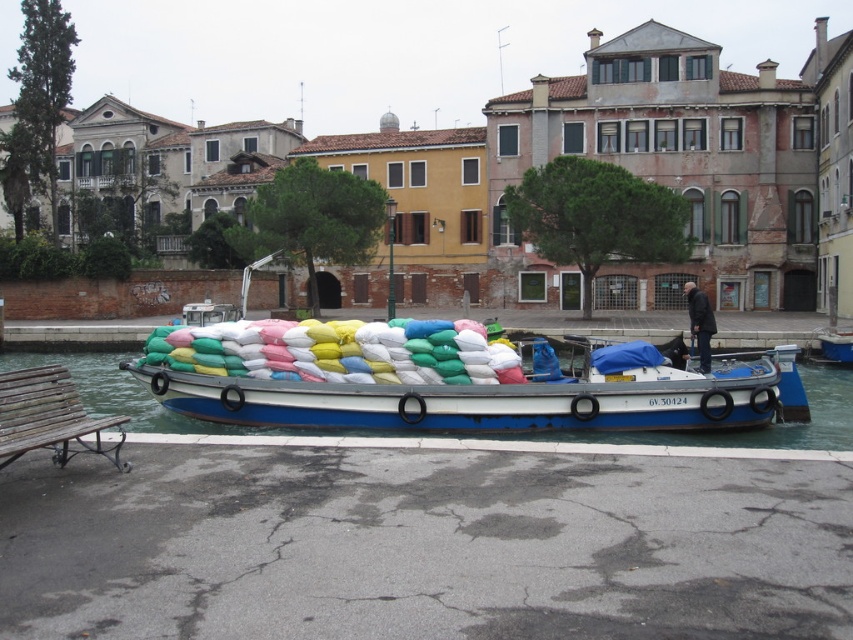
You are a tourist visiting the canal and want to take a photo of the blue painted wood boat at center and the wooden bench at lower left. If you stand at the end of the dock, which object will appear wider in your photo?

The blue painted wood boat at center will appear wider in the photo because its actual width is larger than that of the wooden bench at lower left.